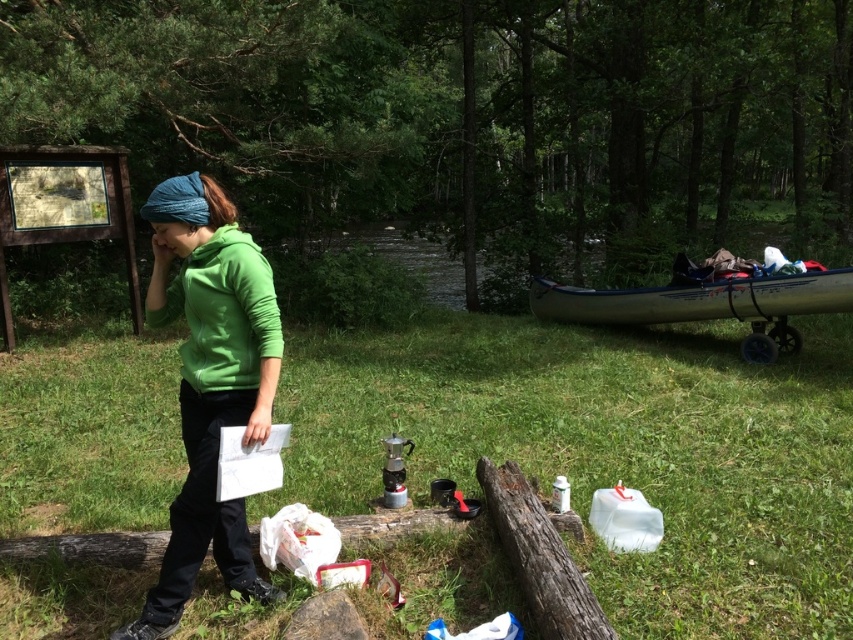
Question: In this image, where is green grass at center located relative to blue plastic canoe at right?

Choices:
 (A) left
 (B) right

Answer: (A)

Question: Can you confirm if white plastic canoe at right is wider than blue plastic canoe at right?

Choices:
 (A) no
 (B) yes

Answer: (A)

Question: Which of the following is the farthest from the observer?

Choices:
 (A) (560, 557)
 (B) (180, 577)
 (C) (744, 465)
 (D) (833, 289)

Answer: (D)

Question: Among these objects, which one is nearest to the camera?

Choices:
 (A) green grass at center
 (B) green fleece jacket at center
 (C) blue plastic canoe at right

Answer: (B)

Question: Can you confirm if green fleece jacket at center is positioned above rough wooden log at lower center?

Choices:
 (A) yes
 (B) no

Answer: (A)

Question: Which object is the farthest from the white plastic canoe at right?

Choices:
 (A) blue plastic canoe at right
 (B) green fleece jacket at center

Answer: (B)